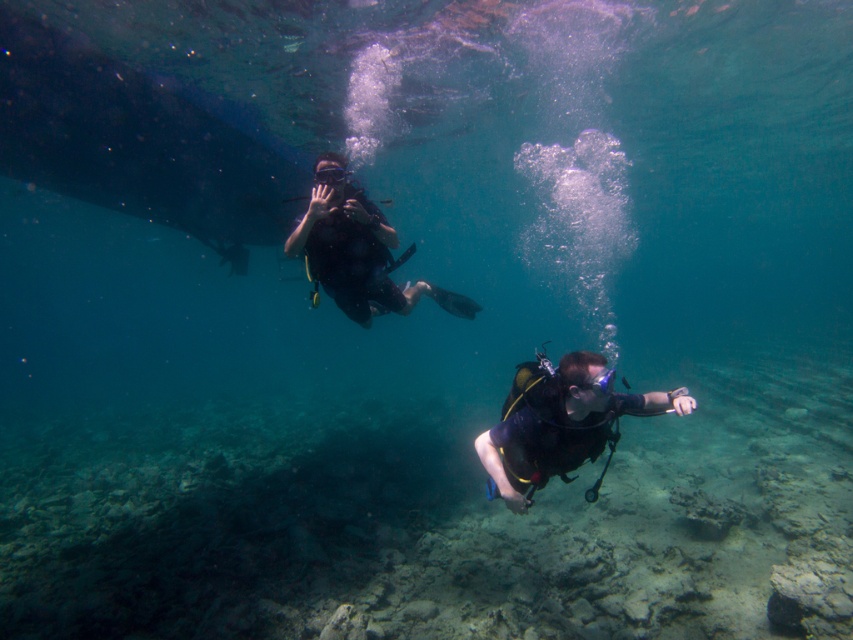
Question: Is the position of matte black scuba diver at center less distant than that of transparent rubber goggles at upper center?

Choices:
 (A) yes
 (B) no

Answer: (A)

Question: Which of the following is the closest to the observer?

Choices:
 (A) matte black wetsuit at center
 (B) transparent rubber goggles at upper center
 (C) matte black scuba diver at center

Answer: (C)

Question: Which of the following is the farthest from the observer?

Choices:
 (A) (349, 173)
 (B) (602, 372)
 (C) (323, 234)

Answer: (A)

Question: Is matte black scuba diver at center closer to the viewer compared to matte black wetsuit at center?

Choices:
 (A) yes
 (B) no

Answer: (A)

Question: Which object is the closest to the matte black wetsuit at center?

Choices:
 (A) matte black scuba diver at center
 (B) transparent rubber goggles at upper center

Answer: (B)

Question: Can you confirm if matte black scuba diver at center is thinner than matte black wetsuit at center?

Choices:
 (A) no
 (B) yes

Answer: (B)